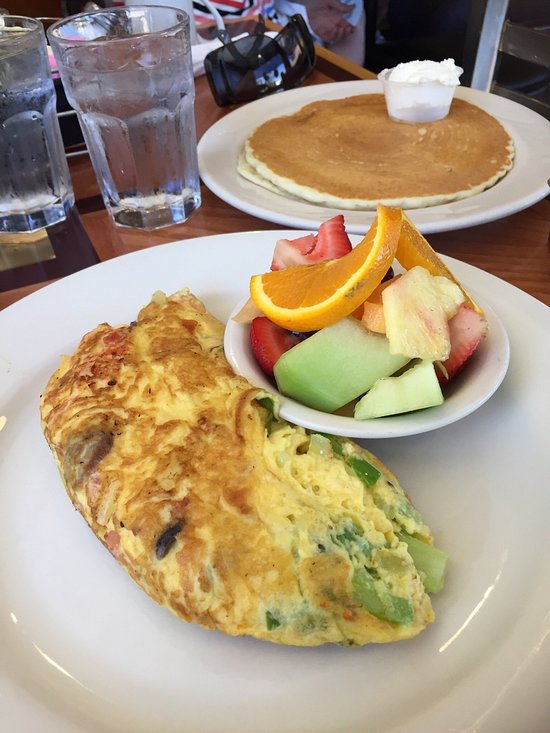
Image resolution: width=550 pixels, height=733 pixels. I want to click on small white bowl, so click(x=371, y=426).